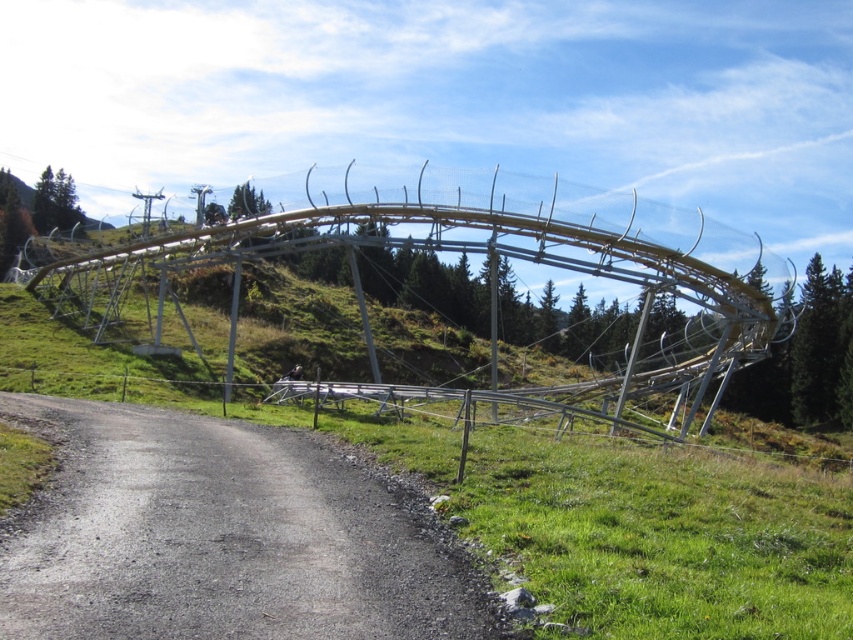
Can you confirm if gray asphalt road at lower left is bigger than metallic silver roller coaster at center?

No, gray asphalt road at lower left is not bigger than metallic silver roller coaster at center.

Does gray asphalt road at lower left have a greater height compared to metallic silver roller coaster at center?

No.

Does point (215, 525) come closer to viewer compared to point (387, 196)?

Yes, it is in front of point (387, 196).

The width and height of the screenshot is (853, 640). Find the location of `gray asphalt road at lower left`. gray asphalt road at lower left is located at coordinates (218, 538).